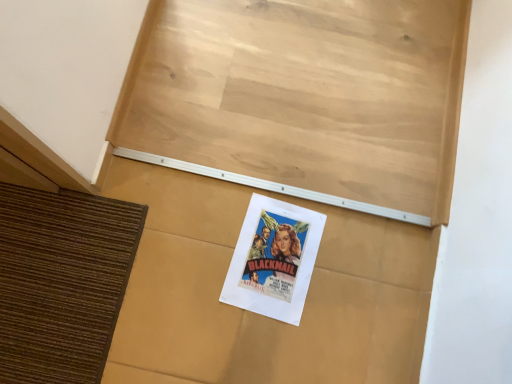
The width and height of the screenshot is (512, 384). In order to click on vacant area situated below white paper poster at center (from a real-world perspective) in this screenshot , I will do `click(214, 226)`.